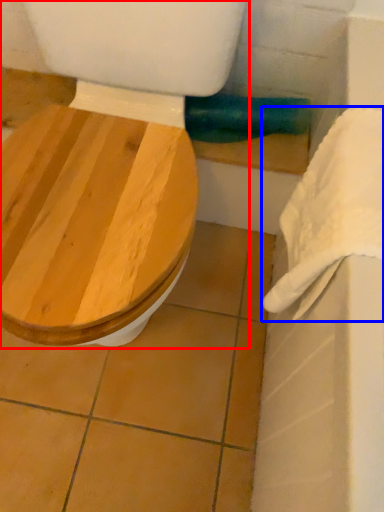
Question: Which of the following is the farthest to the observer, toilet (highlighted by a red box) or towel/napkin (highlighted by a blue box)?

Choices:
 (A) toilet
 (B) towel/napkin

Answer: (B)